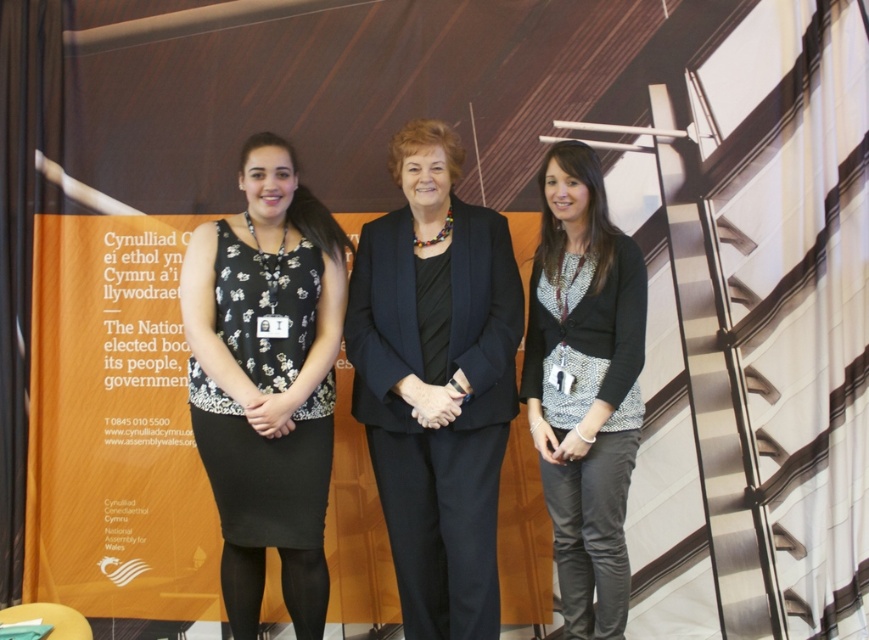
Question: Considering the real-world distances, which object is farthest from the black matte dress at left?

Choices:
 (A) patterned fabric cardigan at center
 (B) black fabric suit at center

Answer: (A)

Question: Which object appears closest to the camera in this image?

Choices:
 (A) patterned fabric cardigan at center
 (B) black fabric suit at center

Answer: (A)

Question: Which point is farther from the camera taking this photo?

Choices:
 (A) (542, 458)
 (B) (312, 582)

Answer: (B)

Question: Is black matte dress at left further to the viewer compared to patterned fabric cardigan at center?

Choices:
 (A) no
 (B) yes

Answer: (B)

Question: Is black fabric suit at center to the right of black matte dress at left from the viewer's perspective?

Choices:
 (A) no
 (B) yes

Answer: (B)

Question: Is black fabric suit at center to the left of patterned fabric cardigan at center from the viewer's perspective?

Choices:
 (A) yes
 (B) no

Answer: (A)